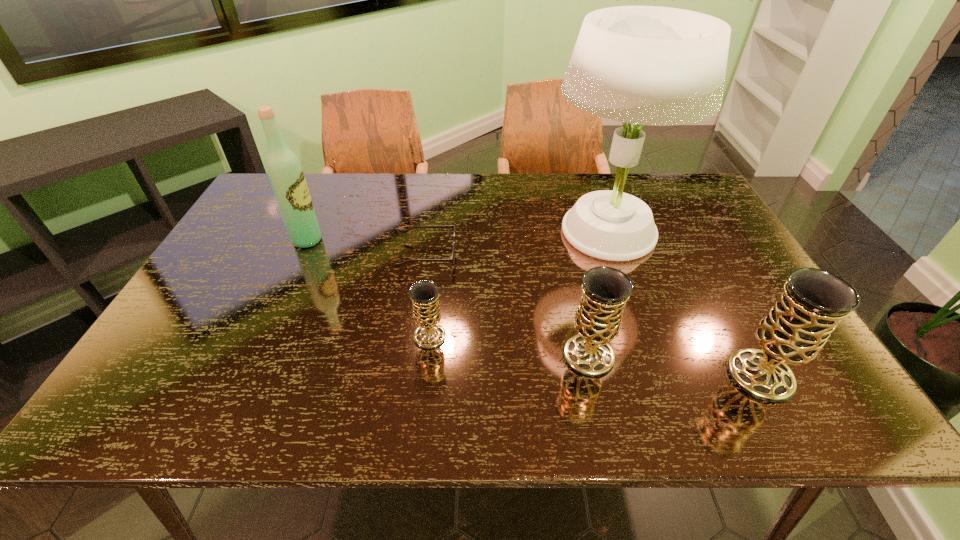
Image resolution: width=960 pixels, height=540 pixels. In order to click on free space at the far edge of the desktop in this screenshot , I will do `click(365, 201)`.

Image resolution: width=960 pixels, height=540 pixels. I want to click on free point at the near edge, so click(538, 369).

Locate an element on the screen. vacant region at the left edge of the desktop is located at coordinates (200, 323).

The image size is (960, 540). What are the coordinates of `free spot at the right edge of the desktop` in the screenshot? It's located at (725, 265).

Identify the location of vacant space at the far right corner of the desktop. (681, 212).

Identify the location of vacant space at the near right corner. This screenshot has height=540, width=960. (807, 369).

The height and width of the screenshot is (540, 960). What are the coordinates of `empty space that is in between the second chalice from left to right and the rightmost chalice` in the screenshot? It's located at [675, 366].

Find the location of a particular element. This screenshot has height=540, width=960. vacant area that lies between the wine bottle and the lamp is located at coordinates (457, 235).

At what (x,y) coordinates should I click in order to perform the action: click on empty location between the fifth tallest object and the second tallest chalice. Please return your answer as a coordinate pair (x, y). Looking at the image, I should click on (509, 346).

Where is `vacant region between the tallest object and the rightmost chalice`? vacant region between the tallest object and the rightmost chalice is located at coordinates (684, 303).